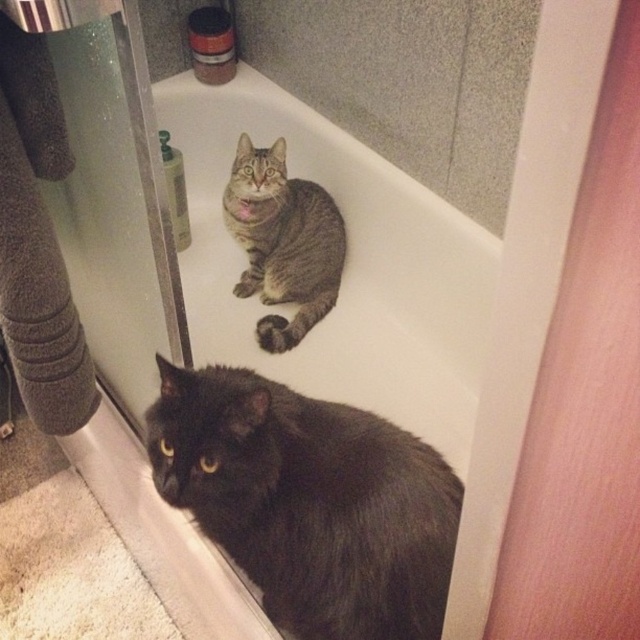
Question: Which point is farther from the camera taking this photo?

Choices:
 (A) (406, 195)
 (B) (406, 525)
 (C) (292, 291)

Answer: (C)

Question: Estimate the real-world distances between objects in this image. Which object is farther from the white glossy bathtub at upper center?

Choices:
 (A) tabby fur cat at upper center
 (B) tabby fur cat at center

Answer: (A)

Question: Does white glossy bathtub at upper center have a greater width compared to tabby fur cat at center?

Choices:
 (A) no
 (B) yes

Answer: (B)

Question: Among these points, which one is nearest to the camera?

Choices:
 (A) (157, 480)
 (B) (253, 195)

Answer: (A)

Question: Observing the image, what is the correct spatial positioning of tabby fur cat at upper center in reference to tabby fur cat at center?

Choices:
 (A) left
 (B) right

Answer: (B)

Question: Can you confirm if tabby fur cat at upper center is bigger than tabby fur cat at center?

Choices:
 (A) no
 (B) yes

Answer: (B)